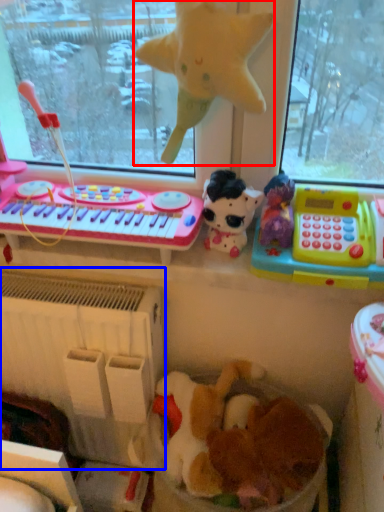
Question: Which object is closer to the camera taking this photo, toy (highlighted by a red box) or radiator (highlighted by a blue box)?

Choices:
 (A) toy
 (B) radiator

Answer: (A)